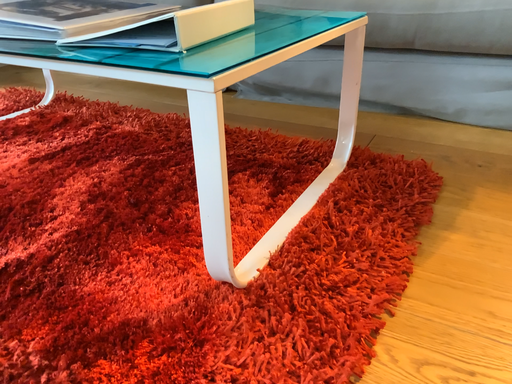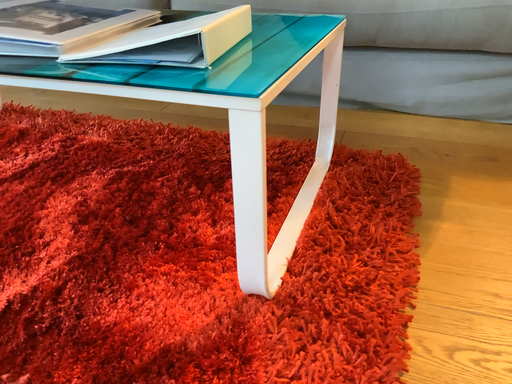
Question: How did the camera likely rotate when shooting the video?

Choices:
 (A) rotated left
 (B) rotated right

Answer: (B)